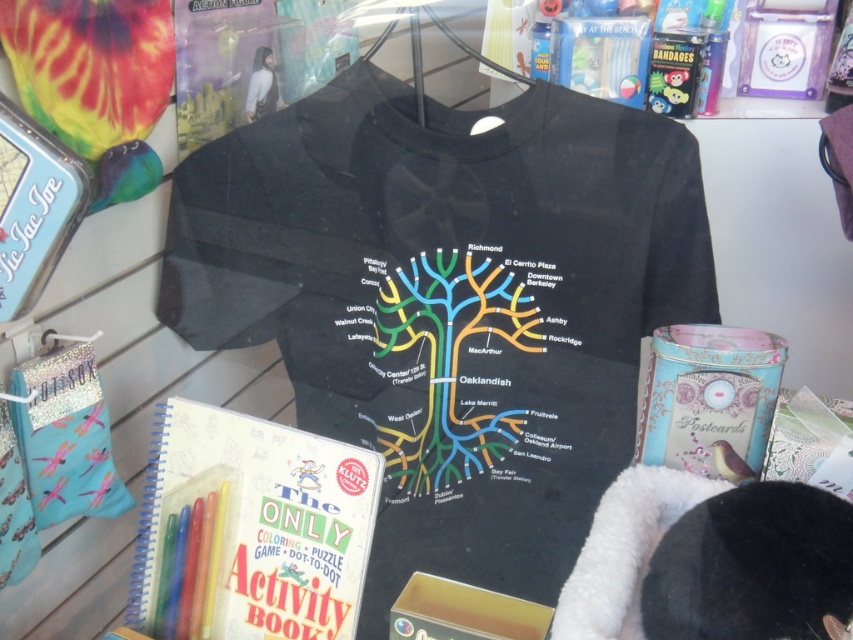
You are organizing a store display and need to place both the matte paper activity book at center and the multicolored map at center on a shelf. The shelf has limited space, and you want to ensure the larger item is placed first to maximize space efficiency. Which item should you place first?

The matte paper activity book at center is bigger than the multicolored map at center, so you should place the matte paper activity book at center first to maximize space efficiency.

You are organizing a store display and need to place a new item between the matte paper activity book at center and the multicolored map at center. Which object should you place the new item closer to if you want it to be above the activity book?

You should place the new item closer to the multicolored map at center because the matte paper activity book at center is located below the multicolored map at center, so the map is above the activity book. Placing the new item closer to the map would position it above the activity book.